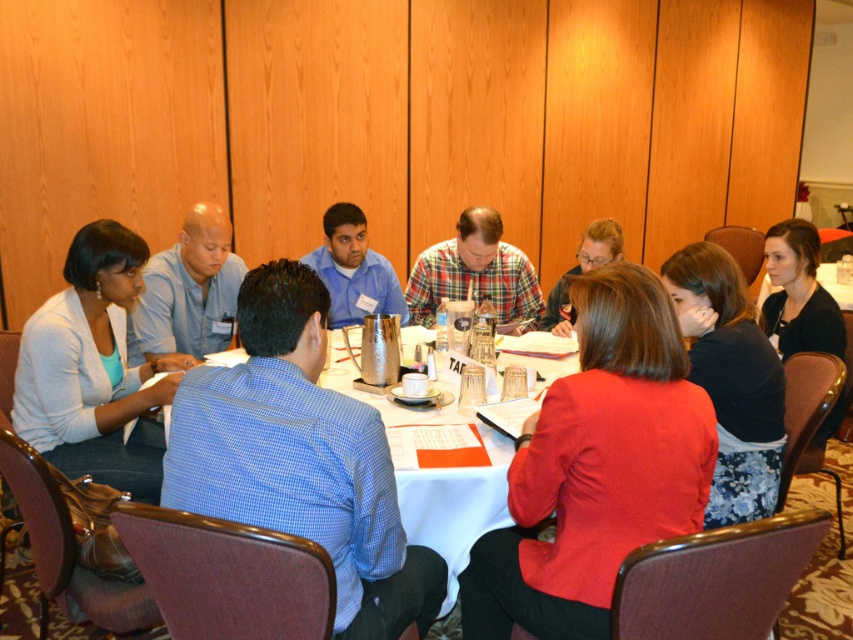
You are a photographer planning to take a group photo of the people around the table. You want to ensure that the plaid fabric shirt at center and the blue shirt at center are both clearly visible in the photo. Which shirt should you position closer to the camera to make sure both are visible without one blocking the other?

The plaid fabric shirt at center is not as tall as the blue shirt at center, so you should position the plaid fabric shirt at center closer to the camera to ensure both are visible without one blocking the other.

You are standing at the edge of the table and want to hand a document to both the plaid fabric shirt at center and the blue shirt at center. Which one should you approach first to ensure you can reach them without moving around the table?

You should approach the plaid fabric shirt at center first because it is closer to you than the blue shirt at center, so you can reach them without needing to move around the table.